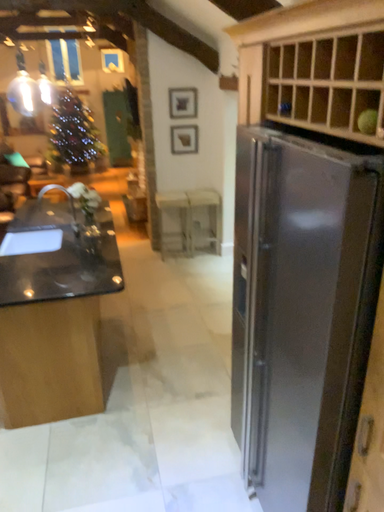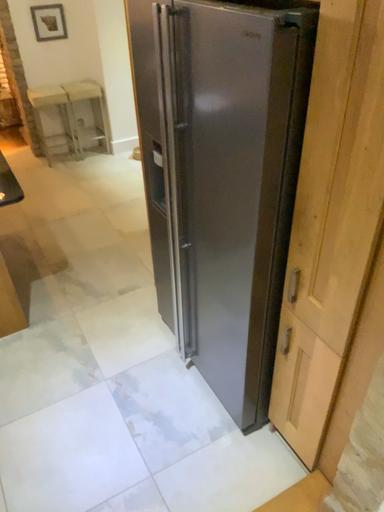
Question: How did the camera likely rotate when shooting the video?

Choices:
 (A) rotated downward
 (B) rotated upward

Answer: (A)